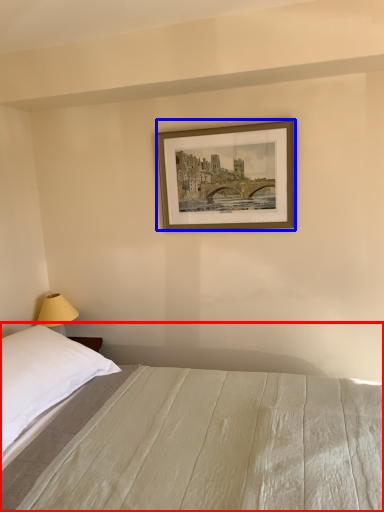
Question: Which point is closer to the camera, bed (highlighted by a red box) or picture frame (highlighted by a blue box)?

Choices:
 (A) bed
 (B) picture frame

Answer: (A)